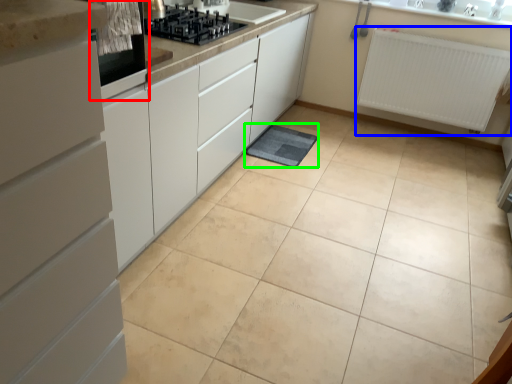
Question: Which object is positioned closest to home appliance (highlighted by a red box)? Select from radiator (highlighted by a blue box) and bath mat (highlighted by a green box).

Choices:
 (A) radiator
 (B) bath mat

Answer: (B)